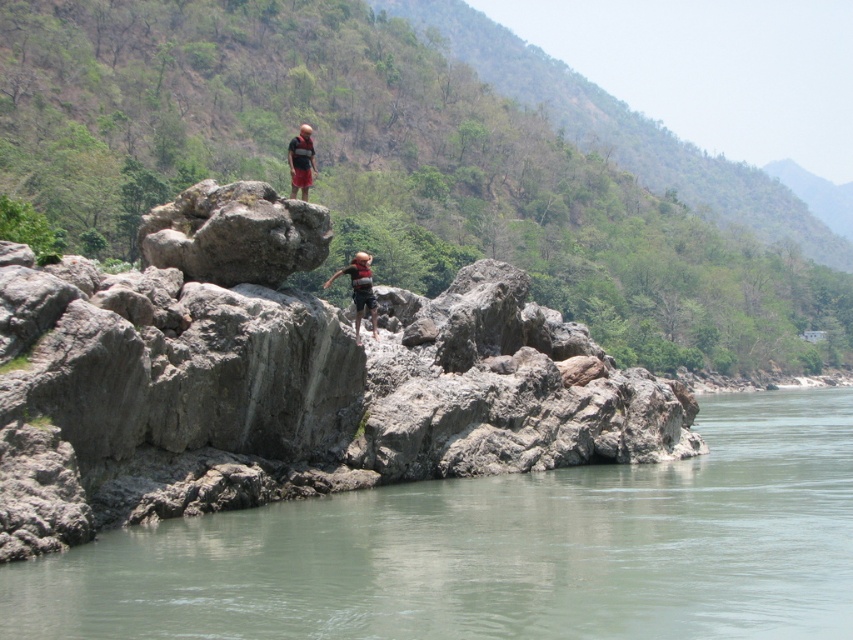
Can you confirm if striped cotton shirt at center is bigger than matte black life vest at center?

No.

Which is more to the left, striped cotton shirt at center or matte black life vest at center?

Positioned to the left is matte black life vest at center.

Is point (355, 266) closer to camera compared to point (305, 134)?

No, it is behind (305, 134).

The width and height of the screenshot is (853, 640). In order to click on striped cotton shirt at center in this screenshot , I will do `click(358, 291)`.

Does gray rough rock at center lie in front of gray rock at lower left?

No.

Is gray rough rock at center to the left of gray rock at lower left from the viewer's perspective?

Correct, you'll find gray rough rock at center to the left of gray rock at lower left.

Which is in front, point (68, 449) or point (805, 554)?

Point (805, 554)

The width and height of the screenshot is (853, 640). I want to click on gray rough rock at center, so click(x=283, y=378).

Identify the location of gray rock at lower left. (498, 550).

Who is positioned more to the right, gray rock at lower left or striped cotton shirt at center?

From the viewer's perspective, gray rock at lower left appears more on the right side.

Which is behind, point (698, 497) or point (360, 259)?

The point (360, 259) is behind.

The width and height of the screenshot is (853, 640). I want to click on gray rock at lower left, so click(498, 550).